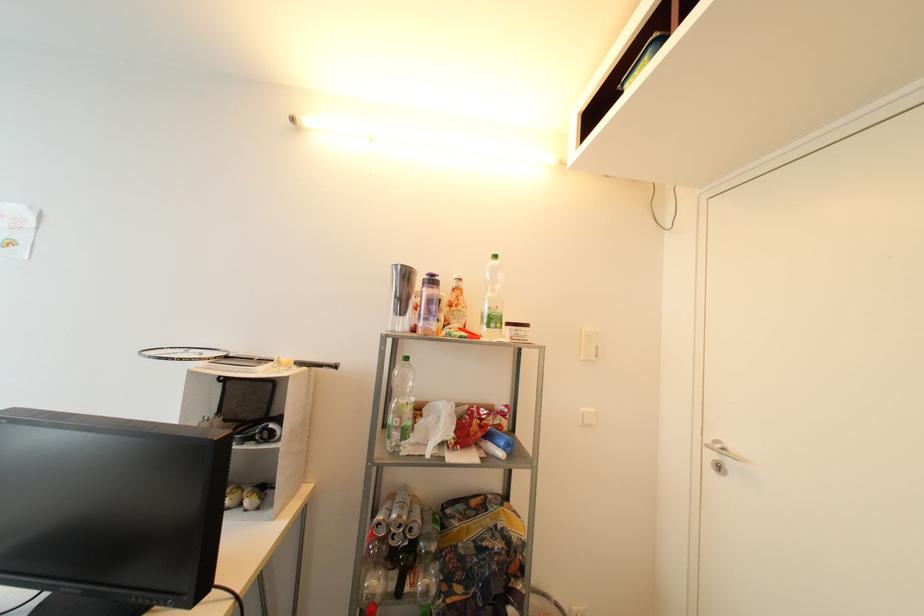
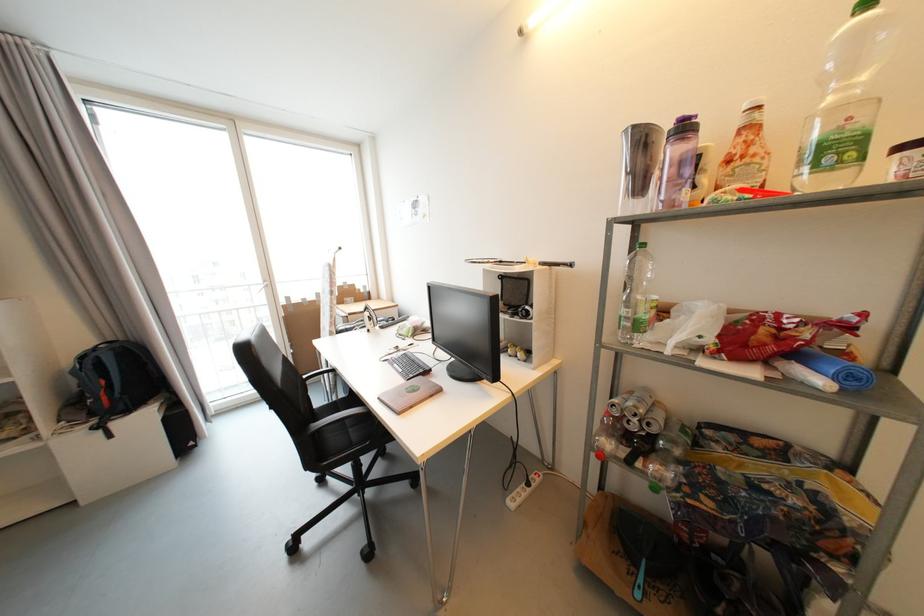
Where in the second image is the point corresponding to (x=493, y=438) from the first image?

(801, 357)